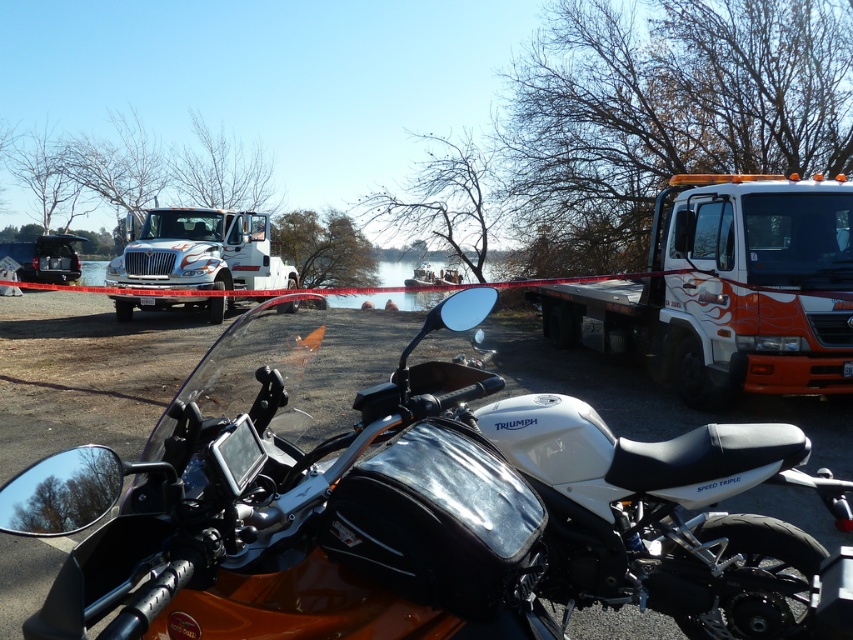
You are a photographer planning to capture a wide shot of the scene. You need to ensure that both the white matte motorcycle at center and the white glossy truck at upper left fit within the frame. Considering their sizes, which object might require more careful framing to avoid being cut off?

The white matte motorcycle at center has a larger width than the white glossy truck at upper left, so it might require more careful framing to avoid being cut off due to its greater size.

You are standing at the point marked by the coordinate system in the image. The motorcycle is located at point (407, 500). If you want to move towards the motorcycle, which direction should you go?

The white matte motorcycle at center is represented by point (407, 500). To move towards it, you should go in the direction of the point (407, 500).